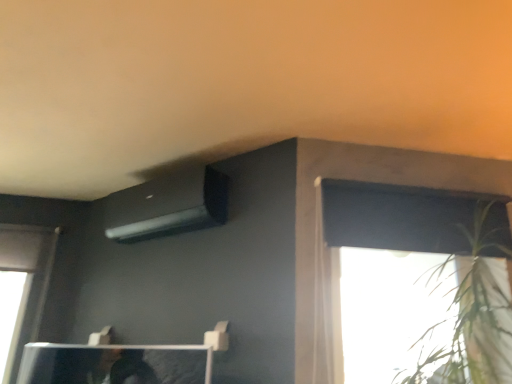
What do you see at coordinates (168, 206) in the screenshot?
I see `black matte air conditioner at upper center` at bounding box center [168, 206].

Locate an element on the screen. The height and width of the screenshot is (384, 512). white sheer curtain at upper right is located at coordinates (326, 301).

Could you measure the distance between green leafy plant at upper right and black matte air conditioner at upper center?

green leafy plant at upper right and black matte air conditioner at upper center are 1.37 meters apart.

The height and width of the screenshot is (384, 512). Find the location of `houseplant in front of the black matte air conditioner at upper center`. houseplant in front of the black matte air conditioner at upper center is located at coordinates (474, 317).

Considering the relative positions of green leafy plant at upper right and black matte air conditioner at upper center in the image provided, is green leafy plant at upper right to the left of black matte air conditioner at upper center from the viewer's perspective?

In fact, green leafy plant at upper right is to the right of black matte air conditioner at upper center.

In the scene shown: Is green leafy plant at upper right completely or partially outside of black matte air conditioner at upper center?

Yes.

Considering the sizes of white sheer curtain at upper right and green leafy plant at upper right in the image, is white sheer curtain at upper right taller or shorter than green leafy plant at upper right?

Clearly, white sheer curtain at upper right is taller compared to green leafy plant at upper right.

Is white sheer curtain at upper right bigger or smaller than green leafy plant at upper right?

In the image, white sheer curtain at upper right appears to be smaller than green leafy plant at upper right.

Which is farther, (x=318, y=353) or (x=460, y=289)?

The point (x=460, y=289) is farther.

Can we say white sheer curtain at upper right lies outside green leafy plant at upper right?

Yes, white sheer curtain at upper right is not within green leafy plant at upper right.

From the image's perspective, is black matte air conditioner at upper center below green leafy plant at upper right?

No.

Is black matte air conditioner at upper center wider than green leafy plant at upper right?

No, black matte air conditioner at upper center is not wider than green leafy plant at upper right.

Is point (203, 191) in front of point (490, 274)?

No, it is behind (490, 274).

From the picture: From a real-world perspective, which is physically above, black matte air conditioner at upper center or green leafy plant at upper right?

In real-world perspective, black matte air conditioner at upper center is above.

Looking at the image, does white sheer curtain at upper right seem bigger or smaller compared to black matte air conditioner at upper center?

In the image, white sheer curtain at upper right appears to be smaller than black matte air conditioner at upper center.

Is the surface of white sheer curtain at upper right in direct contact with black matte air conditioner at upper center?

No, white sheer curtain at upper right is not making contact with black matte air conditioner at upper center.

Does white sheer curtain at upper right turn towards black matte air conditioner at upper center?

No, white sheer curtain at upper right is not turned towards black matte air conditioner at upper center.

Considering the positions of objects white sheer curtain at upper right and black matte air conditioner at upper center in the image provided, who is behind, white sheer curtain at upper right or black matte air conditioner at upper center?

black matte air conditioner at upper center.

Can you confirm if black matte air conditioner at upper center is shorter than white sheer curtain at upper right?

Yes, black matte air conditioner at upper center is shorter than white sheer curtain at upper right.

Considering the positions of objects black matte air conditioner at upper center and white sheer curtain at upper right in the image provided, who is more to the right, black matte air conditioner at upper center or white sheer curtain at upper right?

From the viewer's perspective, white sheer curtain at upper right appears more on the right side.

Can you tell me how much black matte air conditioner at upper center and white sheer curtain at upper right differ in facing direction?

The angle between the facing direction of black matte air conditioner at upper center and the facing direction of white sheer curtain at upper right is 44 degrees.

Does point (133, 241) come behind point (315, 192)?

That is True.

Is there a large distance between green leafy plant at upper right and white sheer curtain at upper right?

No, there isn't a large distance between green leafy plant at upper right and white sheer curtain at upper right.

Considering the relative positions of green leafy plant at upper right and white sheer curtain at upper right in the image provided, is green leafy plant at upper right to the left of white sheer curtain at upper right from the viewer's perspective?

Incorrect, green leafy plant at upper right is not on the left side of white sheer curtain at upper right.

From the image's perspective, which is above, green leafy plant at upper right or white sheer curtain at upper right?

From the image's view, white sheer curtain at upper right is above.

Does green leafy plant at upper right have a smaller size compared to white sheer curtain at upper right?

Incorrect, green leafy plant at upper right is not smaller in size than white sheer curtain at upper right.

Where is `air conditioning above the green leafy plant at upper right (from the image's perspective)`? air conditioning above the green leafy plant at upper right (from the image's perspective) is located at coordinates (168, 206).

Where is `houseplant below the white sheer curtain at upper right (from a real-world perspective)`? The image size is (512, 384). houseplant below the white sheer curtain at upper right (from a real-world perspective) is located at coordinates (474, 317).

When comparing their distances from black matte air conditioner at upper center, does white sheer curtain at upper right or green leafy plant at upper right seem further?

green leafy plant at upper right is positioned further to the anchor black matte air conditioner at upper center.

Looking at the image, which one is located closer to white sheer curtain at upper right, black matte air conditioner at upper center or green leafy plant at upper right?

Among the two, green leafy plant at upper right is located nearer to white sheer curtain at upper right.

Considering their positions, is green leafy plant at upper right positioned closer to black matte air conditioner at upper center than white sheer curtain at upper right?

white sheer curtain at upper right is closer to black matte air conditioner at upper center.

When comparing their distances from white sheer curtain at upper right, does green leafy plant at upper right or black matte air conditioner at upper center seem closer?

green leafy plant at upper right.

From the image, which object appears to be farther from green leafy plant at upper right, white sheer curtain at upper right or black matte air conditioner at upper center?

The object further to green leafy plant at upper right is black matte air conditioner at upper center.

Based on their spatial positions, is black matte air conditioner at upper center or white sheer curtain at upper right further from green leafy plant at upper right?

Based on the image, black matte air conditioner at upper center appears to be further to green leafy plant at upper right.

Where is `curtain between black matte air conditioner at upper center and green leafy plant at upper right`? curtain between black matte air conditioner at upper center and green leafy plant at upper right is located at coordinates (326, 301).